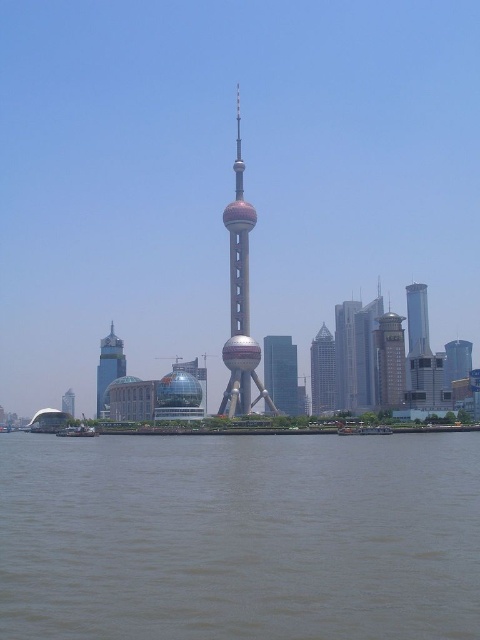
You are standing at the point marked as point (343, 333) in the image, which is 2045.09 feet away from you. You want to take a photo of the Oriental Pearl Tower in the center. Can you see the Oriental Pearl Tower clearly from your current position?

Yes, since you are 2045.09 feet away from point (343, 333), which is your current position, you can see the Oriental Pearl Tower in the center clearly as there are no obstructions mentioned in the scene description.